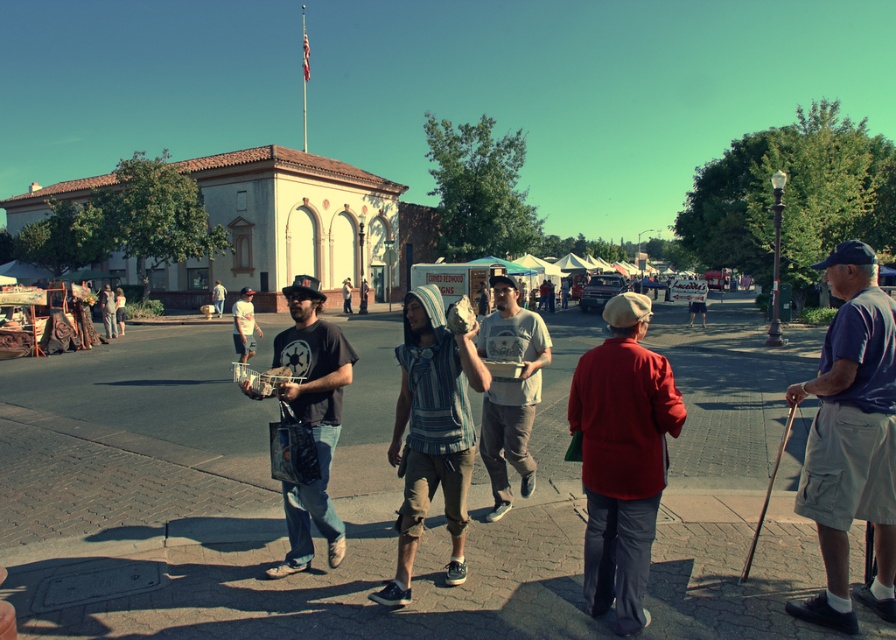
Looking at this image, you are standing at the point labeled point at (225, 520) and want to throw a ball to a friend who is 19.55 feet away. Is the distance within a typical adult human arm length?

The distance between you and your friend is 19.55 feet, which is longer than the typical adult human arm length of around 2 to 3 feet. Therefore, you cannot throw the ball to your friend within arm length.